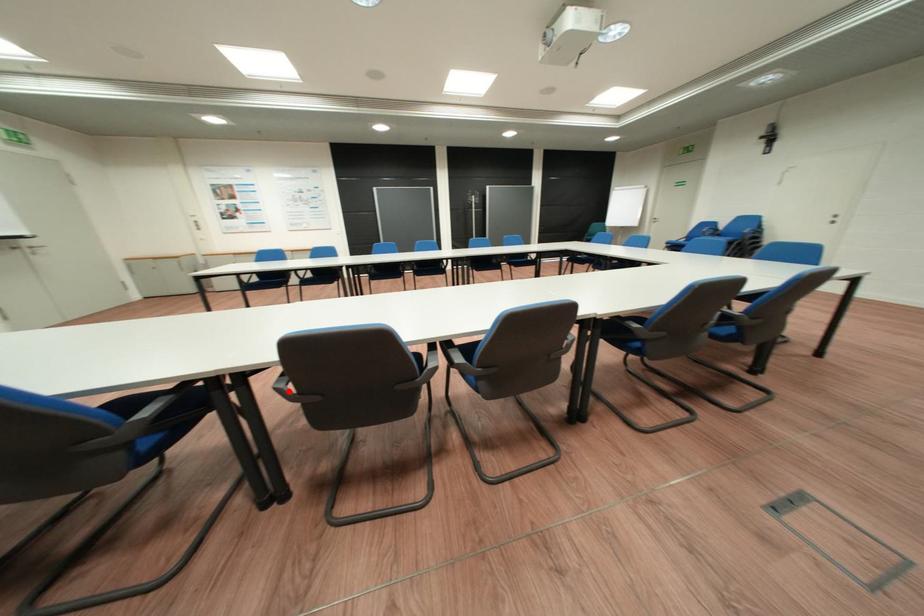
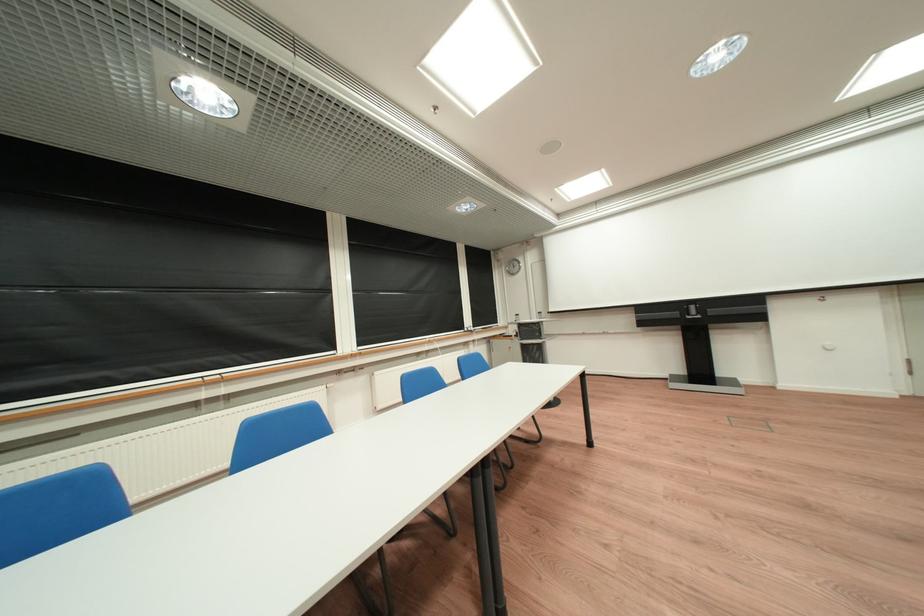
Question: I am providing you with two images of the same scene from different viewpoints. A red point is marked on the first image. Can you still see the location of the red point in image 2?

Choices:
 (A) Yes
 (B) No

Answer: (B)